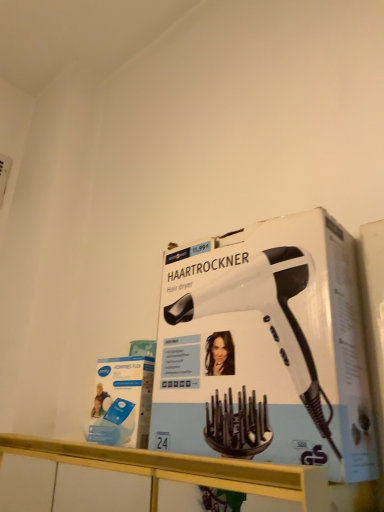
I want to click on white matte hair dryer at center, so click(x=267, y=317).

Describe the element at coordinates (267, 317) in the screenshot. I see `white matte hair dryer at center` at that location.

Describe the element at coordinates (182, 469) in the screenshot. I see `white glossy counter at lower center` at that location.

Measure the distance between point (298, 484) and camera.

13.54 inches.

Find the location of a particular element. white glossy counter at lower center is located at coordinates coord(182,469).

I want to click on white matte hair dryer at center, so coord(267,317).

Does white matte hair dryer at center appear on the right side of white glossy counter at lower center?

Yes.

Considering the relative positions of white matte hair dryer at center and white glossy counter at lower center in the image provided, is white matte hair dryer at center behind white glossy counter at lower center?

Yes, it is behind white glossy counter at lower center.

Is point (203, 303) closer or farther from the camera than point (194, 474)?

Point (203, 303) is farther from the camera than point (194, 474).

From the image's perspective, between white matte hair dryer at center and white glossy counter at lower center, who is located below?

white glossy counter at lower center.

From a real-world perspective, is white matte hair dryer at center positioned over white glossy counter at lower center based on gravity?

Yes, from a real-world perspective, white matte hair dryer at center is over white glossy counter at lower center

Is white matte hair dryer at center thinner than white glossy counter at lower center?

Indeed, white matte hair dryer at center has a lesser width compared to white glossy counter at lower center.

Is white matte hair dryer at center taller than white glossy counter at lower center?

Yes, white matte hair dryer at center is taller than white glossy counter at lower center.

From the picture: Based on their sizes in the image, would you say white matte hair dryer at center is bigger or smaller than white glossy counter at lower center?

In the image, white matte hair dryer at center appears to be smaller than white glossy counter at lower center.

Is white matte hair dryer at center situated inside white glossy counter at lower center or outside?

white matte hair dryer at center is not enclosed by white glossy counter at lower center.

Would you consider white matte hair dryer at center to be distant from white glossy counter at lower center?

They are positioned close to each other.

From the picture: Is white matte hair dryer at center oriented towards white glossy counter at lower center?

No, white matte hair dryer at center does not turn towards white glossy counter at lower center.

What's the angular difference between white matte hair dryer at center and white glossy counter at lower center's facing directions?

The angle between the facing direction of white matte hair dryer at center and the facing direction of white glossy counter at lower center is 5.32 degrees.

In order to click on counter that is in front of the white matte hair dryer at center in this screenshot , I will do `click(182, 469)`.

Considering the positions of objects white glossy counter at lower center and white matte hair dryer at center in the image provided, who is more to the right, white glossy counter at lower center or white matte hair dryer at center?

white matte hair dryer at center is more to the right.

Considering the positions of objects white glossy counter at lower center and white matte hair dryer at center in the image provided, who is behind, white glossy counter at lower center or white matte hair dryer at center?

white matte hair dryer at center is further from the camera.

Does point (179, 469) come behind point (294, 283)?

No, (179, 469) is closer to viewer.

From the image's perspective, is white glossy counter at lower center on top of white matte hair dryer at center?

No.

From a real-world perspective, is white glossy counter at lower center located higher than white matte hair dryer at center?

No, from a real-world perspective, white glossy counter at lower center is not above white matte hair dryer at center.

Is white glossy counter at lower center wider than white matte hair dryer at center?

Indeed, white glossy counter at lower center has a greater width compared to white matte hair dryer at center.

Considering the sizes of white glossy counter at lower center and white matte hair dryer at center in the image, is white glossy counter at lower center taller or shorter than white matte hair dryer at center?

In the image, white glossy counter at lower center appears to be shorter than white matte hair dryer at center.

Considering the sizes of objects white glossy counter at lower center and white matte hair dryer at center in the image provided, who is bigger, white glossy counter at lower center or white matte hair dryer at center?

With larger size is white glossy counter at lower center.

Is white glossy counter at lower center spatially inside white matte hair dryer at center, or outside of it?

white glossy counter at lower center is not inside white matte hair dryer at center, it's outside.

Are white glossy counter at lower center and white matte hair dryer at center located far from each other?

No, white glossy counter at lower center is not far away from white matte hair dryer at center.

Based on the photo, is white glossy counter at lower center facing towards white matte hair dryer at center?

No, white glossy counter at lower center is not aimed at white matte hair dryer at center.

How far apart are white glossy counter at lower center and white matte hair dryer at center?

white glossy counter at lower center and white matte hair dryer at center are 5.69 inches apart from each other.

The width and height of the screenshot is (384, 512). In the image, there is a white matte hair dryer at center. Identify the location of counter below it (from a real-world perspective). click(182, 469).

Identify the location of counter below the white matte hair dryer at center (from the image's perspective). The width and height of the screenshot is (384, 512). (182, 469).

Find the location of a particular element. This screenshot has width=384, height=512. counter below the white matte hair dryer at center (from a real-world perspective) is located at coordinates (182, 469).